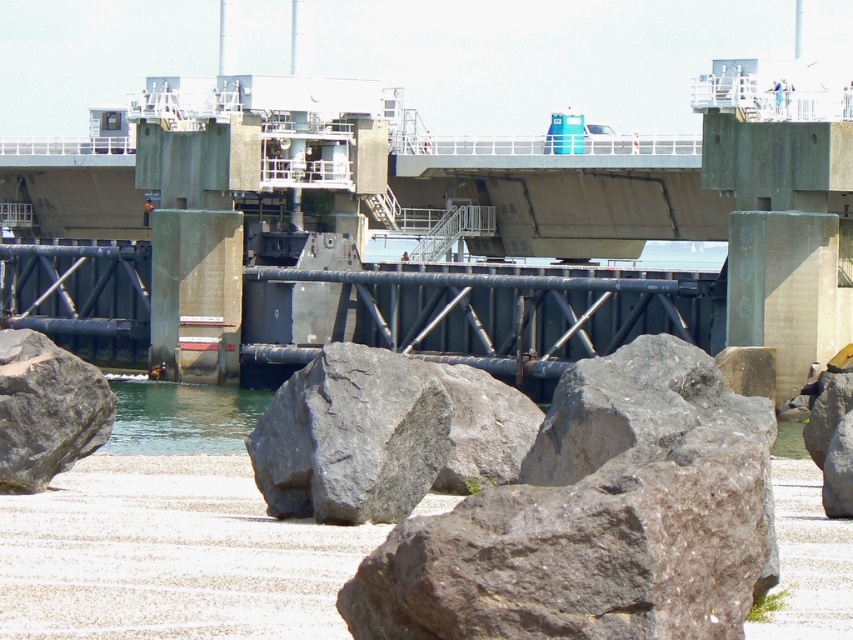
Image resolution: width=853 pixels, height=640 pixels. What do you see at coordinates (351, 436) in the screenshot?
I see `gray rough stone at center` at bounding box center [351, 436].

Does gray rough stone at center appear over gray rough rock at lower left?

No, gray rough stone at center is not above gray rough rock at lower left.

Between point (325, 518) and point (44, 388), which one is positioned in front?

Point (325, 518) is more forward.

Locate an element on the screen. gray rough stone at center is located at coordinates (351, 436).

From the picture: Does gray rough stone at center appear under gray rough rock at center?

Actually, gray rough stone at center is above gray rough rock at center.

Does gray rough stone at center have a greater height compared to gray rough rock at center?

Yes, gray rough stone at center is taller than gray rough rock at center.

Find the location of a particular element. gray rough stone at center is located at coordinates (351, 436).

Locate an element on the screen. This screenshot has height=640, width=853. gray rough stone at center is located at coordinates (351, 436).

Which of these two, gray rough rock at lower left or gray rough rock at center, stands shorter?

gray rough rock at center

Between gray rough rock at lower left and gray rough rock at center, which one appears on the left side from the viewer's perspective?

gray rough rock at lower left

This screenshot has width=853, height=640. Describe the element at coordinates (45, 410) in the screenshot. I see `gray rough rock at lower left` at that location.

Find the location of `gray rough rock at lower left`. gray rough rock at lower left is located at coordinates (45, 410).